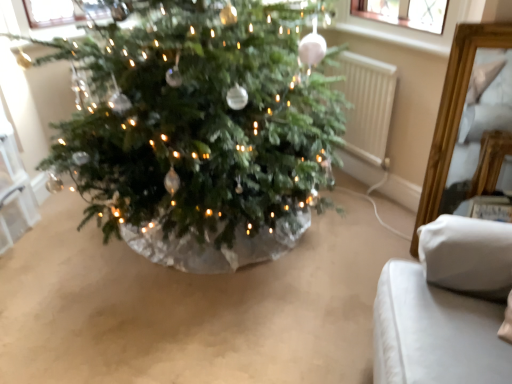
The image size is (512, 384). I want to click on free spot above white plastic radiator at center right (from a real-world perspective), so click(x=361, y=52).